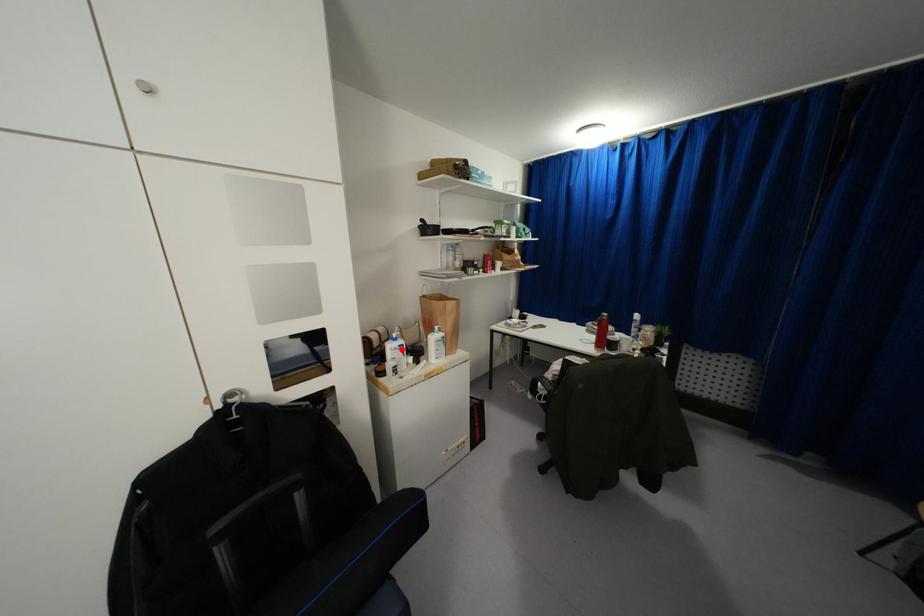
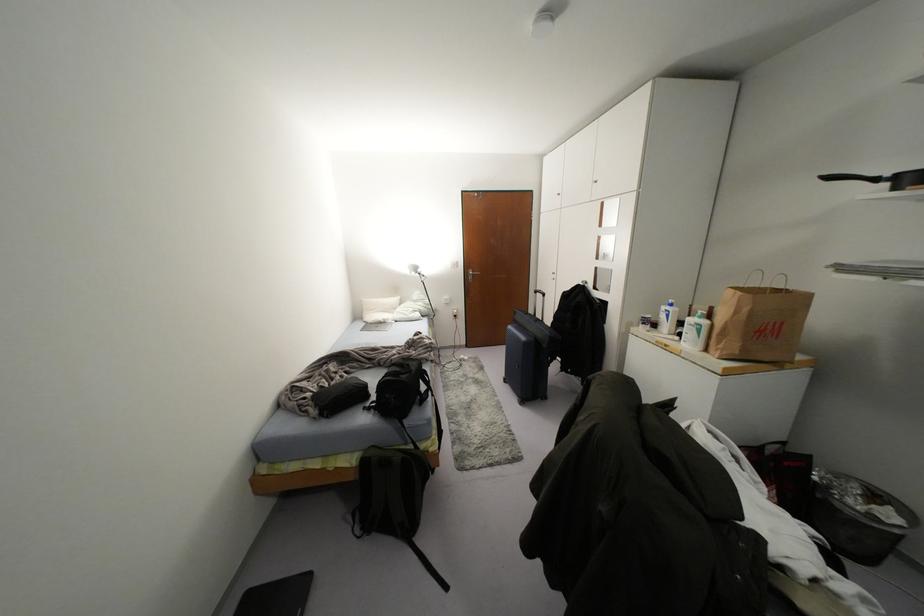
Locate, in the second image, the point that corresponds to the highlighted location in the first image.

(666, 315)